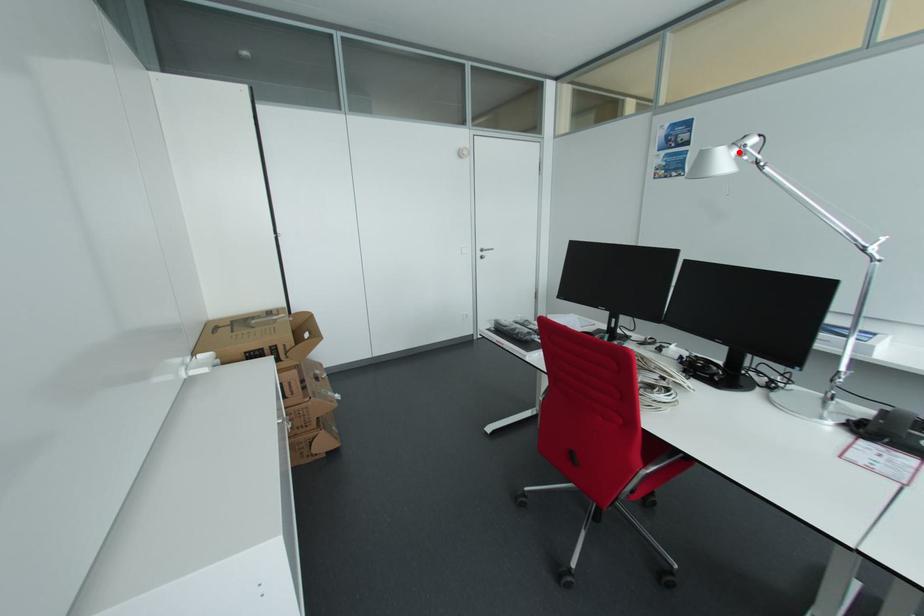
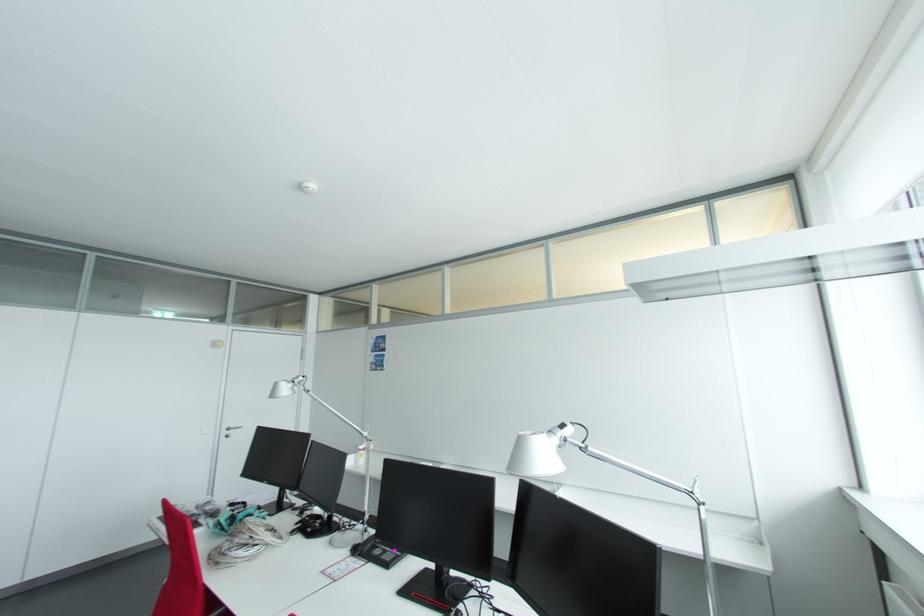
Where in the second image is the point corresponding to the highlighted location from the first image?

(295, 385)